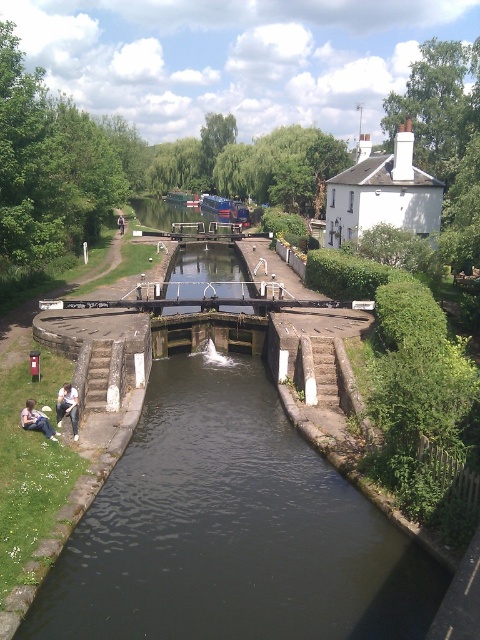
You are a delivery person carrying a package and need to cross the canal. You see the smooth concrete lock gate at center and the light blue jeans at lower left. Which object is bigger and can you use it as a stepping stone?

The smooth concrete lock gate at center is larger in size compared to the light blue jeans at lower left. However, the lock gate is part of the canal structure and likely not a suitable stepping stone for crossing. The light blue jeans at lower left, while smaller, might be a person or an object not meant for stepping on. Neither is appropriate for crossing the canal safely. Consider using a bridge or designated path instead.

You are a boat captain navigating a small boat through the canal. You notice the dark stone water at center and the smooth concrete lock gate at center. Which object is located above the other?

The smooth concrete lock gate at center is above the dark stone water at center because the dark stone water at center is positioned under the smooth concrete lock gate at center.

You are standing at the edge of the canal and want to reach the red post box located on the left side. You see the smooth concrete lock gate at center and the light blue jeans at lower left. Which object is closer to your current position?

The light blue jeans at lower left is behind the smooth concrete lock gate at center, so the smooth concrete lock gate at center is closer to your current position.